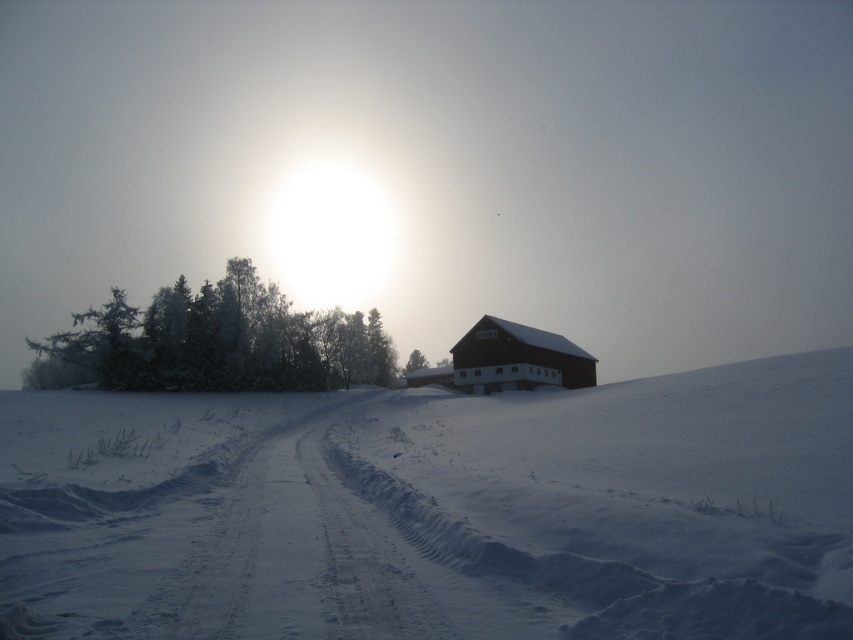
Question: Does white powdery snow at center appear under dark brown wooden barn at center?

Choices:
 (A) no
 (B) yes

Answer: (B)

Question: From the image, what is the correct spatial relationship of white powdery snow at center in relation to dark brown wooden barn at center?

Choices:
 (A) above
 (B) below

Answer: (B)

Question: Is white powdery snow at center to the right of snow-covered trees at left from the viewer's perspective?

Choices:
 (A) yes
 (B) no

Answer: (A)

Question: Among these points, which one is farthest from the camera?

Choices:
 (A) (173, 492)
 (B) (589, 385)
 (C) (299, 369)

Answer: (B)

Question: Which point is farther to the camera?

Choices:
 (A) dark brown wooden barn at center
 (B) snow-covered trees at left
 (C) white powdery snow at center

Answer: (A)

Question: Which point appears closest to the camera in this image?

Choices:
 (A) (503, 339)
 (B) (289, 492)
 (C) (161, 387)

Answer: (B)